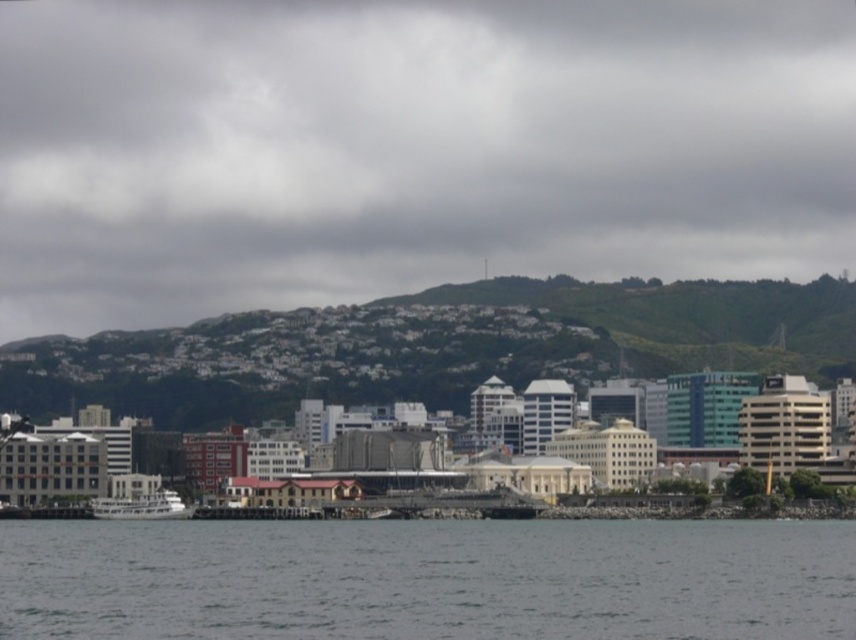
Question: Which object is positioned closest to the green grassy hill at upper center?

Choices:
 (A) gray water at lower center
 (B) white matte boat at lower left

Answer: (B)

Question: In this image, where is gray water at lower center located relative to white matte boat at lower left?

Choices:
 (A) left
 (B) right

Answer: (B)

Question: Which is farther from the green grassy hill at upper center?

Choices:
 (A) gray water at lower center
 (B) white matte boat at lower left

Answer: (A)

Question: Is gray water at lower center above white matte boat at lower left?

Choices:
 (A) yes
 (B) no

Answer: (B)

Question: Can you confirm if green grassy hill at upper center is positioned to the right of white matte boat at lower left?

Choices:
 (A) no
 (B) yes

Answer: (B)

Question: Among these objects, which one is nearest to the camera?

Choices:
 (A) green grassy hill at upper center
 (B) white matte boat at lower left
 (C) gray water at lower center

Answer: (C)